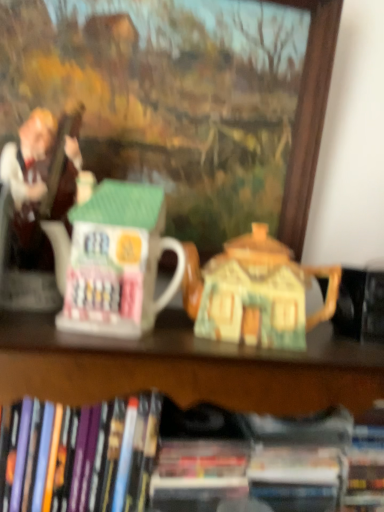
Question: Does hardcover book at lower left, the first book when ordered from left to right, have a greater height compared to matte brown statue at left?

Choices:
 (A) yes
 (B) no

Answer: (B)

Question: From the image's perspective, does hardcover book at lower left, which is the second book in right-to-left order, appear lower than matte brown statue at left?

Choices:
 (A) no
 (B) yes

Answer: (B)

Question: Does hardcover book at lower left, which is the second book in right-to-left order, turn towards matte brown statue at left?

Choices:
 (A) yes
 (B) no

Answer: (B)

Question: Does hardcover book at lower left, the first book when ordered from left to right, have a lesser width compared to matte brown statue at left?

Choices:
 (A) no
 (B) yes

Answer: (A)

Question: Is hardcover book at lower left, which is the second book in right-to-left order, at the right side of matte brown statue at left?

Choices:
 (A) yes
 (B) no

Answer: (A)

Question: From a real-world perspective, is hardcover book at lower left, the first book when ordered from left to right, located beneath matte brown statue at left?

Choices:
 (A) no
 (B) yes

Answer: (B)

Question: Is matte ceramic house at center in contact with matte brown statue at left?

Choices:
 (A) yes
 (B) no

Answer: (B)

Question: Can you confirm if matte ceramic house at center is positioned to the right of matte brown statue at left?

Choices:
 (A) yes
 (B) no

Answer: (A)

Question: Does matte ceramic house at center lie in front of matte brown statue at left?

Choices:
 (A) yes
 (B) no

Answer: (B)

Question: Are matte ceramic house at center and matte brown statue at left far apart?

Choices:
 (A) no
 (B) yes

Answer: (A)

Question: Considering the relative positions of matte ceramic house at center and matte brown statue at left in the image provided, is matte ceramic house at center behind matte brown statue at left?

Choices:
 (A) yes
 (B) no

Answer: (A)

Question: Is matte brown statue at left at the back of matte ceramic house at center?

Choices:
 (A) no
 (B) yes

Answer: (B)

Question: Considering the relative positions of hardcover book at lower center, the first book when ordered from right to left, and matte ceramic house at center in the image provided, is hardcover book at lower center, the first book when ordered from right to left, to the left of matte ceramic house at center from the viewer's perspective?

Choices:
 (A) yes
 (B) no

Answer: (B)